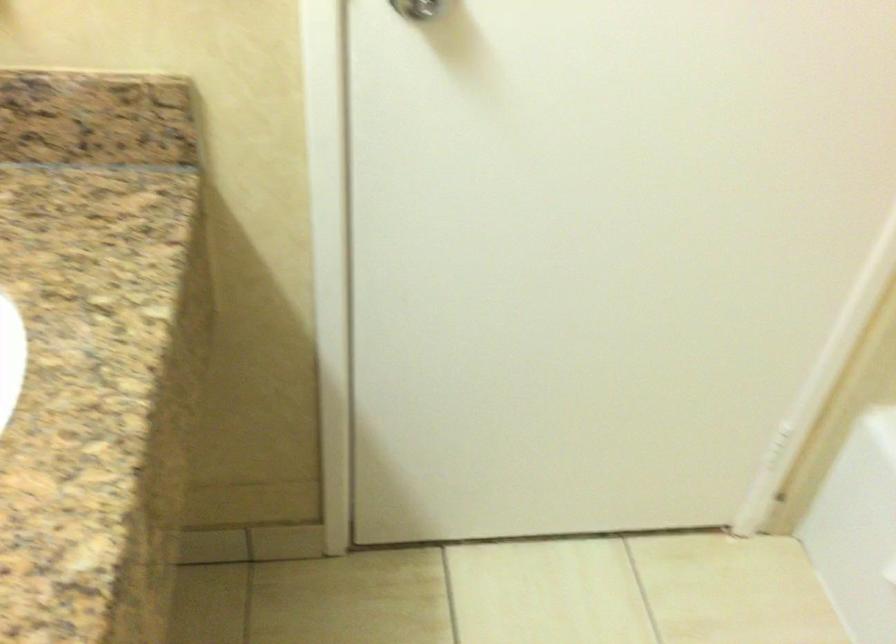
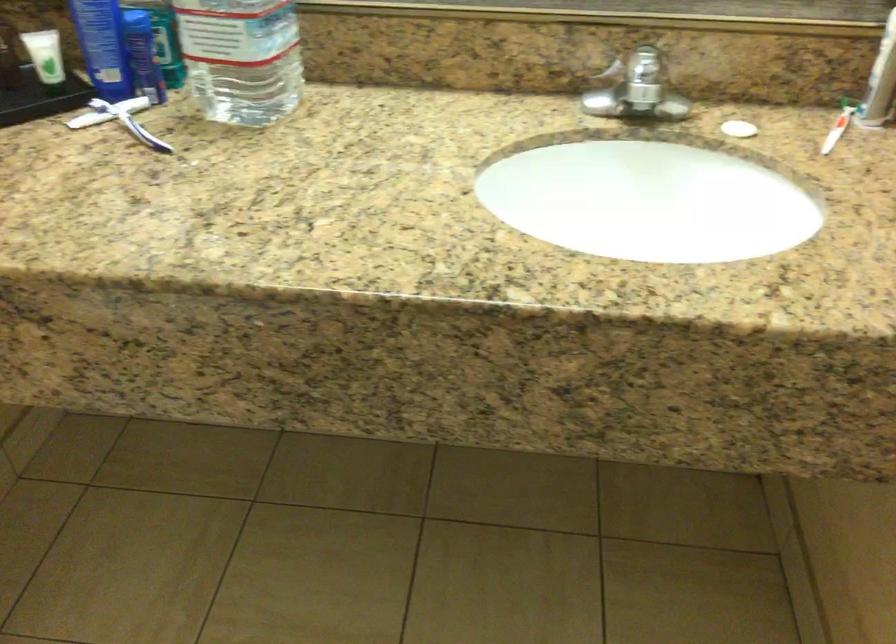
Consider the image. Based on the continuous images, in which direction is the camera rotating?

The camera's rotation is toward left-down.